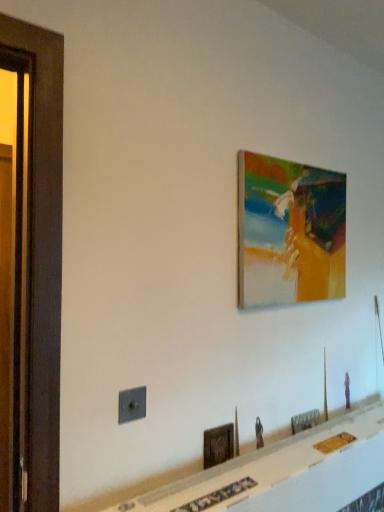
Question: Considering the relative sizes of wooden screen door at left and wooden picture frame at lower center, which is counted as the third picture frame, starting from the left, in the image provided, is wooden screen door at left wider than wooden picture frame at lower center, which is counted as the third picture frame, starting from the left,?

Choices:
 (A) yes
 (B) no

Answer: (A)

Question: Is wooden screen door at left taller than wooden picture frame at lower center, which is counted as the third picture frame, starting from the left?

Choices:
 (A) no
 (B) yes

Answer: (B)

Question: Is wooden screen door at left facing away from wooden picture frame at lower center, arranged as the 1th picture frame when viewed from the right?

Choices:
 (A) yes
 (B) no

Answer: (B)

Question: Considering the relative positions of wooden screen door at left and wooden picture frame at lower center, which is counted as the third picture frame, starting from the left, in the image provided, is wooden screen door at left behind wooden picture frame at lower center, which is counted as the third picture frame, starting from the left,?

Choices:
 (A) yes
 (B) no

Answer: (B)

Question: From the image's perspective, is wooden screen door at left on wooden picture frame at lower center, placed as the 3th picture frame when sorted from top to bottom?

Choices:
 (A) no
 (B) yes

Answer: (B)

Question: Looking at the image, does wooden screen door at left seem bigger or smaller compared to wooden picture frame at lower center, placed as the 3th picture frame when sorted from top to bottom?

Choices:
 (A) big
 (B) small

Answer: (A)

Question: In terms of width, does wooden screen door at left look wider or thinner when compared to wooden picture frame at lower center, which is counted as the third picture frame, starting from the left?

Choices:
 (A) wide
 (B) thin

Answer: (A)

Question: In terms of height, does wooden screen door at left look taller or shorter compared to wooden picture frame at lower center, which is counted as the third picture frame, starting from the left?

Choices:
 (A) tall
 (B) short

Answer: (A)

Question: Considering the positions of point (36, 304) and point (314, 414), is point (36, 304) closer or farther from the camera than point (314, 414)?

Choices:
 (A) farther
 (B) closer

Answer: (B)

Question: Which is correct: wooden picture frame at lower center, the first picture frame when ordered from bottom to top, is inside metallic gray outlet at lower left, or outside of it?

Choices:
 (A) outside
 (B) inside

Answer: (A)

Question: From a real-world perspective, is wooden picture frame at lower center, placed as the 3th picture frame when sorted from top to bottom, above or below metallic gray outlet at lower left?

Choices:
 (A) below
 (B) above

Answer: (A)

Question: From the image's perspective, is wooden picture frame at lower center, arranged as the 1th picture frame when viewed from the right, positioned above or below metallic gray outlet at lower left?

Choices:
 (A) below
 (B) above

Answer: (A)

Question: Is point (291, 431) positioned closer to the camera than point (140, 415)?

Choices:
 (A) closer
 (B) farther

Answer: (B)

Question: Looking at the image, does metallic gray outlet at lower left seem bigger or smaller compared to wooden picture frame at lower center, placed as the third picture frame when sorted from right to left?

Choices:
 (A) small
 (B) big

Answer: (A)

Question: In the image, is metallic gray outlet at lower left on the left side or the right side of wooden picture frame at lower center, the 1th picture frame from the left?

Choices:
 (A) left
 (B) right

Answer: (A)